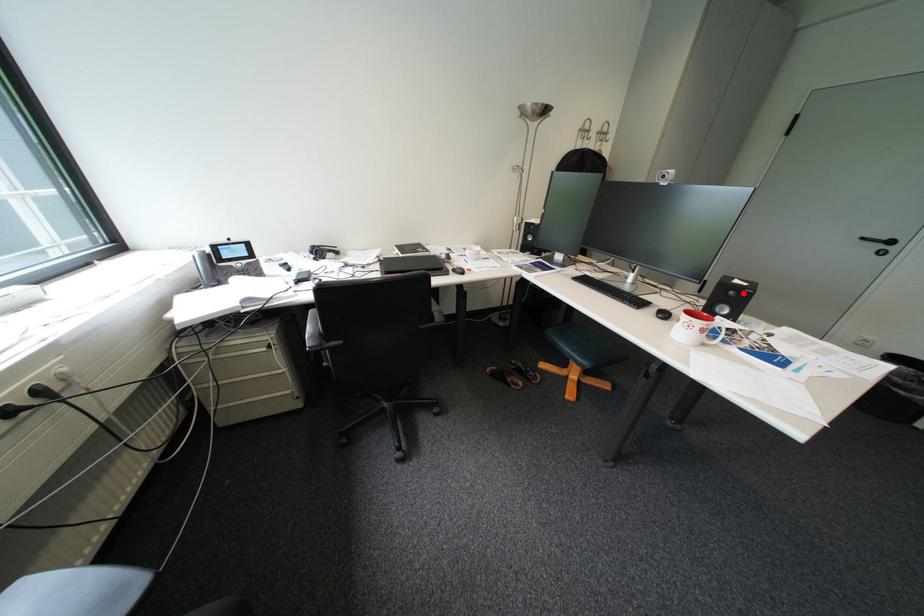
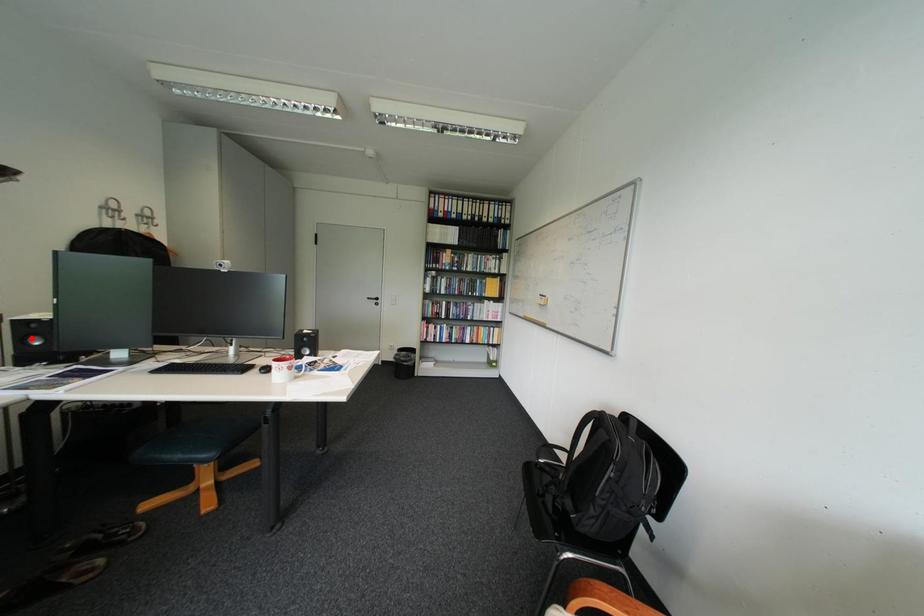
I am providing you with two images of the same scene from different viewpoints. A red point is marked on the first image and another point is marked on the second image. Is the marked point in image1 the same physical position as the marked point in image2?

No